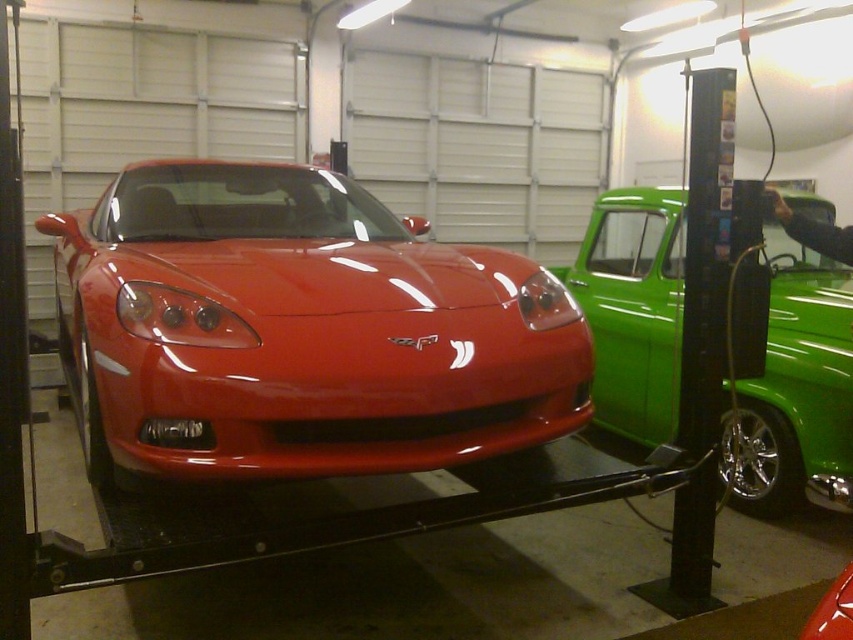
You are a mechanic standing in the garage and need to access the engine of the glossy red sports car at center and the green glossy pickup truck at right. Which vehicle will require you to move further back to reach its engine?

The green glossy pickup truck at right will require moving further back because it is farther from the viewer compared to the glossy red sports car at center.

You are a mechanic working in the garage. You need to move a tool box that is 2 meters long from the glossy red sports car at center to the camera. Is the distance sufficient to move it without lifting?

The glossy red sports car at center and camera are 2.10 meters apart. Since the tool box is 2 meters long, the distance is sufficient to move it without lifting as it is slightly longer than the tool box.

You are a mechanic working in the garage. You need to move the green glossy pickup truck at right closer to the glossy red sports car at center for alignment. Considering their sizes, which vehicle will require more space to maneuver?

The glossy red sports car at center has a larger size compared to the green glossy pickup truck at right, so it requires more space to maneuver.